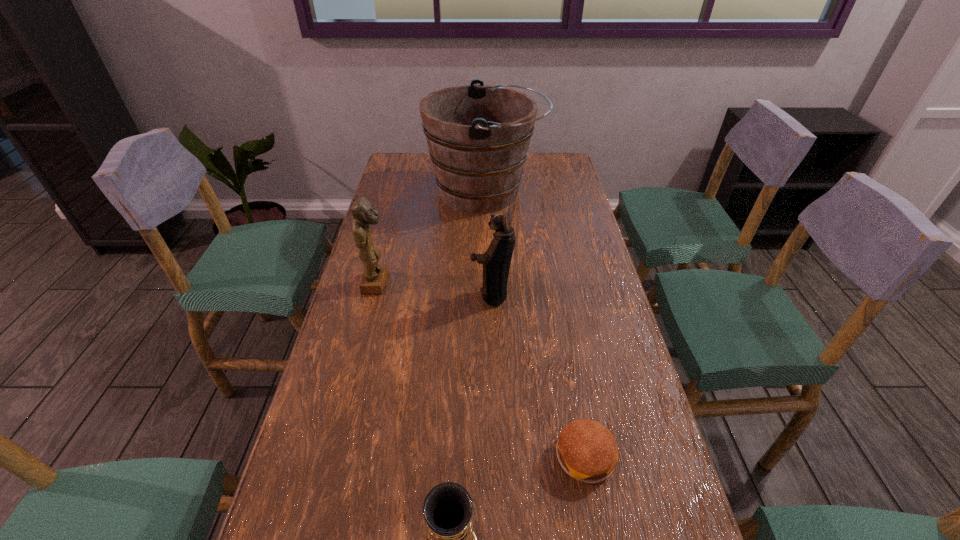
The width and height of the screenshot is (960, 540). Identify the location of bucket. (478, 136).

You are a GUI agent. You are given a task and a screenshot of the screen. Output one action in this format:
    pyautogui.click(x=<x>, y=<y>)
    Task: Click on the farthest object
    The width and height of the screenshot is (960, 540).
    Given the screenshot: What is the action you would take?
    pyautogui.click(x=478, y=136)

Locate an element on the screen. This screenshot has width=960, height=540. the right figurine is located at coordinates (496, 261).

What are the coordinates of `the left figurine` in the screenshot? It's located at (374, 278).

Find the location of a particular element. the second nearest object is located at coordinates (587, 451).

Where is `the shortest object`? The height and width of the screenshot is (540, 960). the shortest object is located at coordinates (587, 451).

Identify the location of free point located 0.050m on the handle side of the tallest object. (556, 193).

Find the location of a particular element. vacant point located on the front-facing side of the right figurine is located at coordinates (368, 295).

Find the location of a particular element. free spot located 0.260m on the front-facing side of the right figurine is located at coordinates (378, 295).

Locate an element on the screen. Image resolution: width=960 pixels, height=540 pixels. vacant space located on the front-facing side of the right figurine is located at coordinates (421, 295).